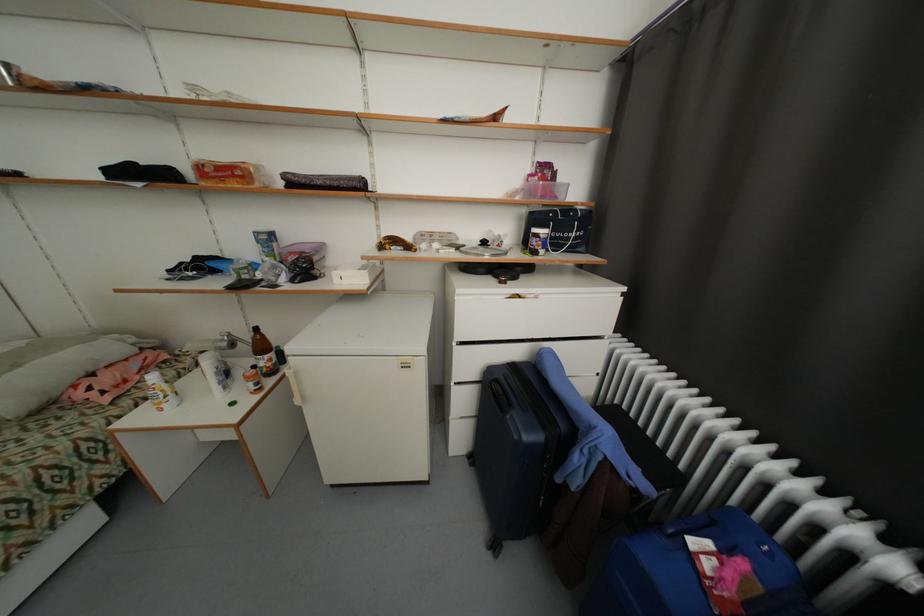
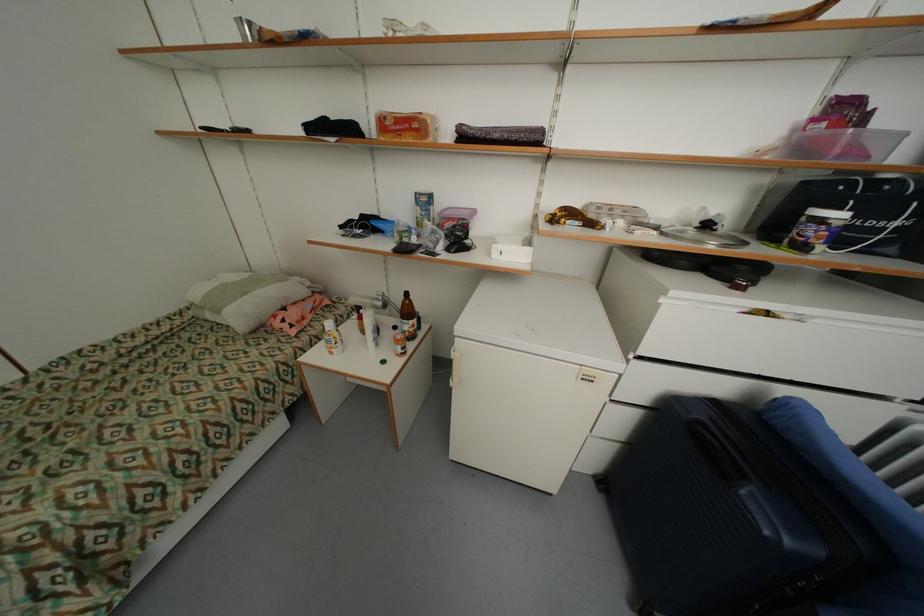
Question: Which direction would the cameraman need to move to produce the second image? Reply with the corresponding letter.

Choices:
 (A) Left
 (B) Right
 (C) Forward
 (D) Backward

Answer: (A)